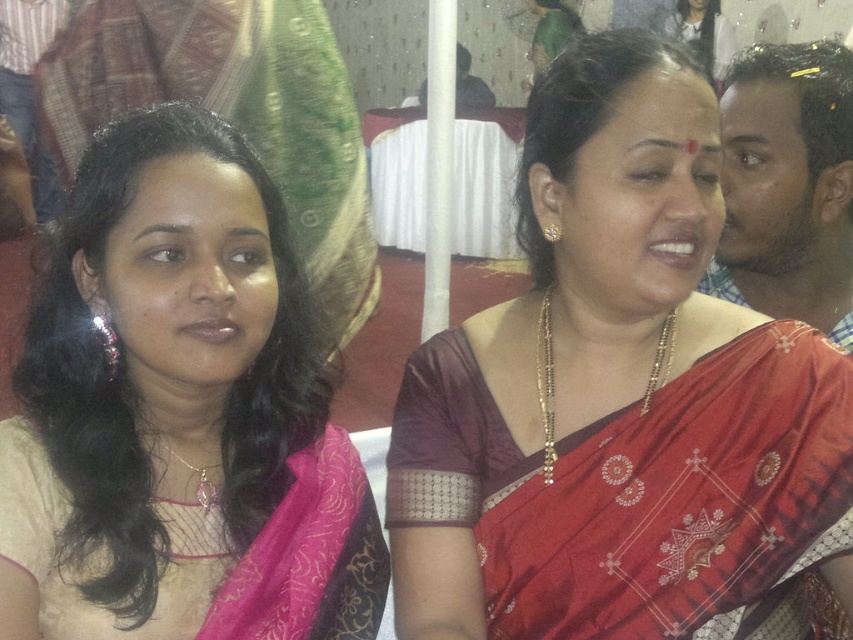
You are a photographer at the event and want to ensure both the matte gold necklace at upper center and the pink silk saree at left are clearly visible in your photo. Which object should you focus on first to ensure proper exposure, considering their sizes?

The matte gold necklace at upper center has a larger size compared to the pink silk saree at left, so you should focus on the matte gold necklace at upper center first to ensure proper exposure due to its larger size.

You are a photographer at the event and want to capture a closeup of the matte gold necklace at upper center. Based on its coordinates, where should you focus your camera?

The matte gold necklace at upper center is located at point (616, 396), so focus the camera there.

You are a photographer at a cultural event and need to frame a closeup shot of the matte gold necklace at upper center and the pink silk saree at left. Which object requires a wider frame to capture its full width?

The matte gold necklace at upper center might be wider than the pink silk saree at left, so the photographer should use a wider frame for the matte gold necklace at upper center to ensure it is fully captured.